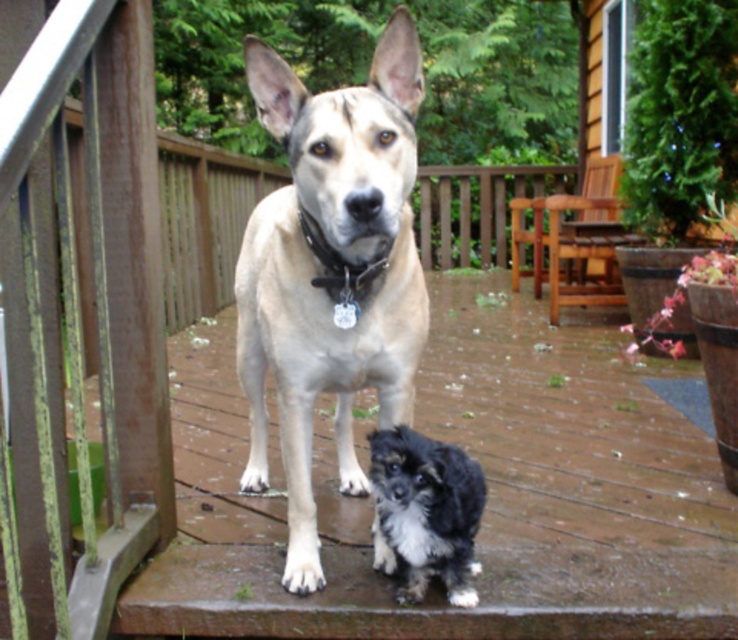
From the picture: You are a photographer trying to capture both dogs in the scene. Given that the light brown fur dog at center is wider than the black fuzzy dog at lower center, which dog should you position closer to the camera to ensure both fit in the frame?

Since the light brown fur dog at center is wider than the black fuzzy dog at lower center, you should position the smaller black fuzzy dog at lower center closer to the camera to ensure both fit within the frame.

You are a delivery robot trying to reach the front door. You see the black fuzzy dog at lower center and the metallic chain at center. Which object is closer to the ground?

The black fuzzy dog at lower center is located below the metallic chain at center, so the black fuzzy dog at lower center is closer to the ground.

You are standing on the wooden deck and want to place a small potted plant between the two points marked as point (348, 376) and point (303, 227). Which point should the plant be closer to in order to be nearer to the camera?

The plant should be closer to point (348, 376) because it is further to the camera than point (303, 227).